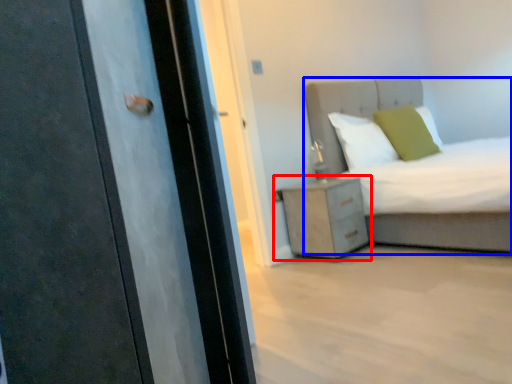
Question: Which object appears farthest to the camera in this image, nightstand (highlighted by a red box) or bed (highlighted by a blue box)?

Choices:
 (A) nightstand
 (B) bed

Answer: (A)